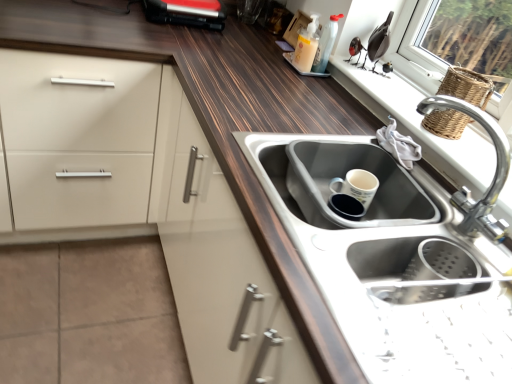
You are a GUI agent. You are given a task and a screenshot of the screen. Output one action in this format:
    pyautogui.click(x=<x>, y=<y>)
    Task: Click on the free space to the back side of woven brown basket at upper right
    The image size is (512, 384).
    Given the screenshot: What is the action you would take?
    pyautogui.click(x=401, y=94)